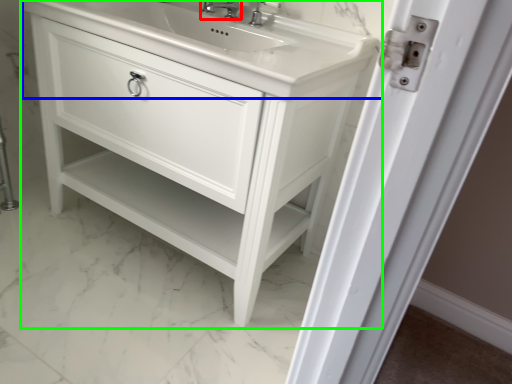
Question: Which object is positioned farthest from tap (highlighted by a red box)? Select from counter top (highlighted by a blue box) and bathroom cabinet (highlighted by a green box).

Choices:
 (A) counter top
 (B) bathroom cabinet

Answer: (B)